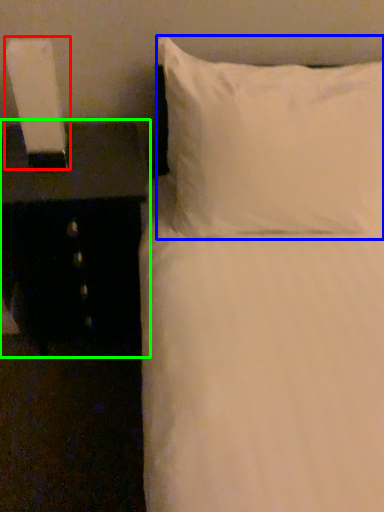
Question: Which is farther away from bedside lamp (highlighted by a red box)? pillow (highlighted by a blue box) or nightstand (highlighted by a green box)?

Choices:
 (A) pillow
 (B) nightstand

Answer: (A)